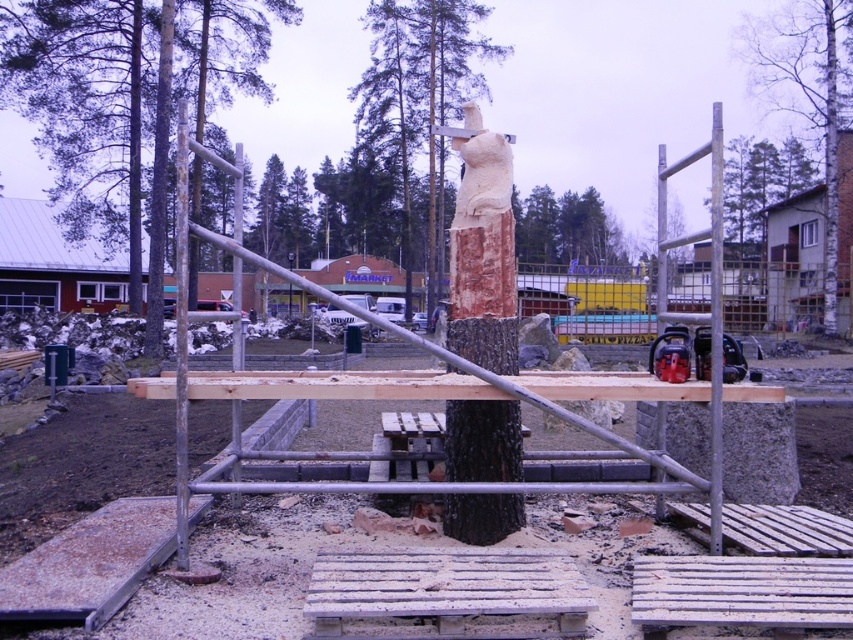
You are a park planner designing a new outdoor exhibit. You have two objects in front of you, the brown wood tree at center and the smooth brown tree trunk at center. Based on their sizes, which one would you choose to place as the central feature of the exhibit to ensure it stands out more?

The brown wood tree at center is larger in size than the smooth brown tree trunk at center, so it would be the better choice to place as the central feature to ensure it stands out more.

You are an artist examining the tree sculpture. You notice the smooth wood carving at center and the bark at center. Which one is positioned higher?

The smooth wood carving at center is positioned higher than the bark at center.

You are an artist who wants to paint the smooth wood carving at center and the smooth silver pole at right. From your current position, which object is closer to you?

The smooth wood carving at center is closer to you because the smooth silver pole at right is behind it.